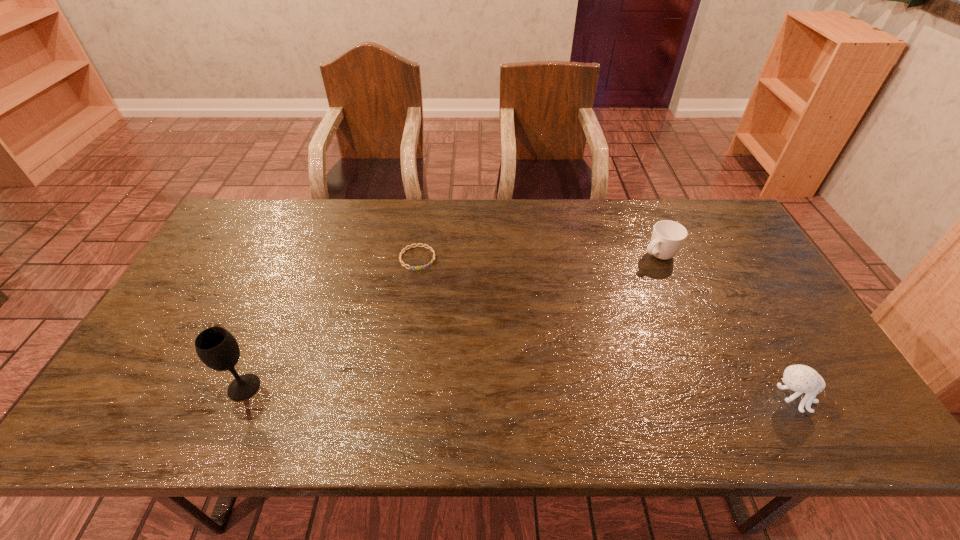
Image resolution: width=960 pixels, height=540 pixels. I want to click on vacant spot on the desktop that is between the wineglass and the rightmost object and is positioned with the handle on the side of the cup, so click(445, 391).

Find the location of a particular element. The height and width of the screenshot is (540, 960). vacant space on the desktop that is between the wineglass and the octopus and is positioned on the surface of the bracelet showing star-shaped elements is located at coordinates (478, 392).